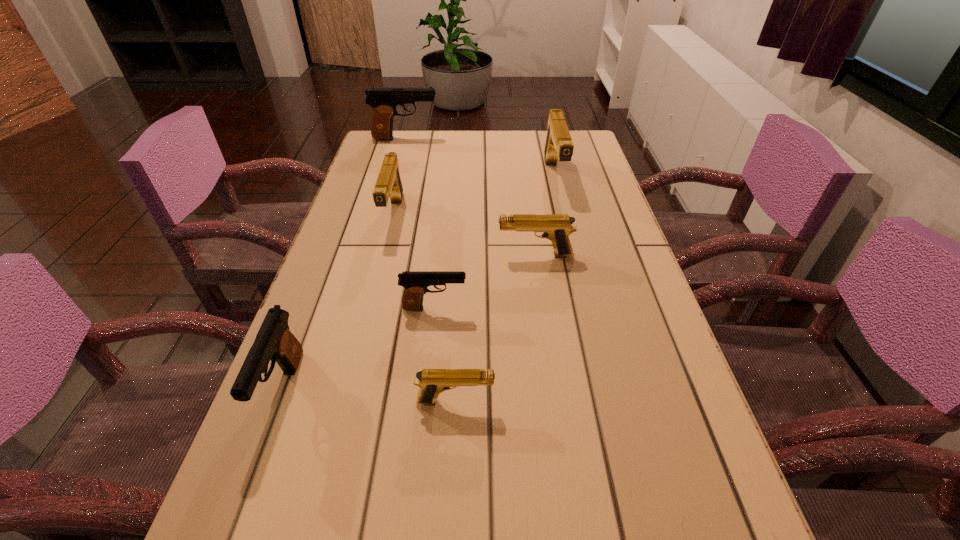
The height and width of the screenshot is (540, 960). I want to click on free space that satisfies the following two spatial constraints: 1. at the barrel of the biggest tan pistol; 2. at the barrel of the shortest object, so click(x=607, y=401).